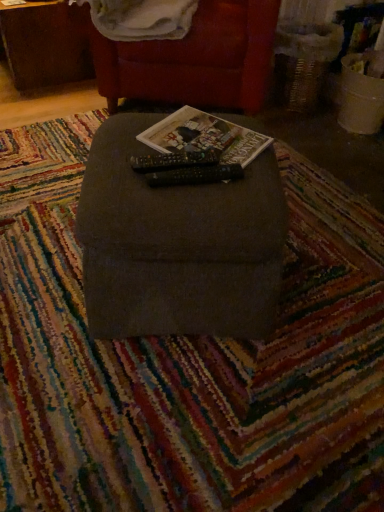
Locate an element on the screen. free point to the right of dark gray fabric ottoman at center, which appears as the second furniture when viewed from the back is located at coordinates (329, 274).